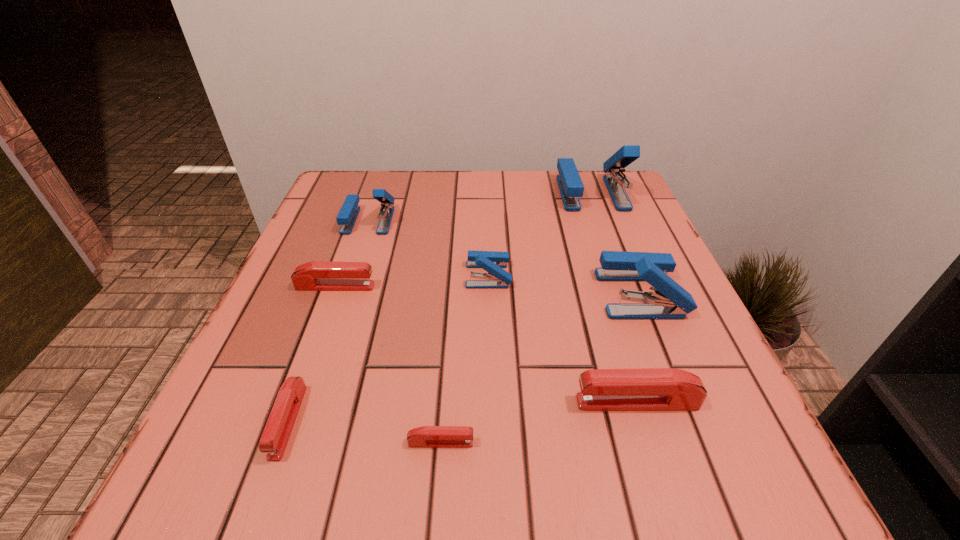
Where is `vacant space situated on the front-facing side of the rightmost red stapler`? This screenshot has height=540, width=960. vacant space situated on the front-facing side of the rightmost red stapler is located at coordinates (503, 402).

Find the location of a particular element. This screenshot has width=960, height=540. vacant area located on the front-facing side of the farthest red stapler is located at coordinates (540, 287).

Where is `vacant space located 0.160m on the front-facing side of the smallest red stapler`? vacant space located 0.160m on the front-facing side of the smallest red stapler is located at coordinates (589, 443).

The height and width of the screenshot is (540, 960). What are the coordinates of `object located in the far left corner section of the desktop` in the screenshot? It's located at (347, 216).

I want to click on object present at the near left corner, so click(277, 431).

What are the coordinates of `object at the far right corner` in the screenshot? It's located at (571, 187).

Where is `vacant space at the far edge of the desktop`? Image resolution: width=960 pixels, height=540 pixels. vacant space at the far edge of the desktop is located at coordinates (423, 174).

I want to click on vacant space at the near edge of the desktop, so click(622, 464).

Find the location of a particular element. vacant area at the left edge of the desktop is located at coordinates (372, 221).

This screenshot has height=540, width=960. I want to click on free space at the right edge of the desktop, so click(x=663, y=428).